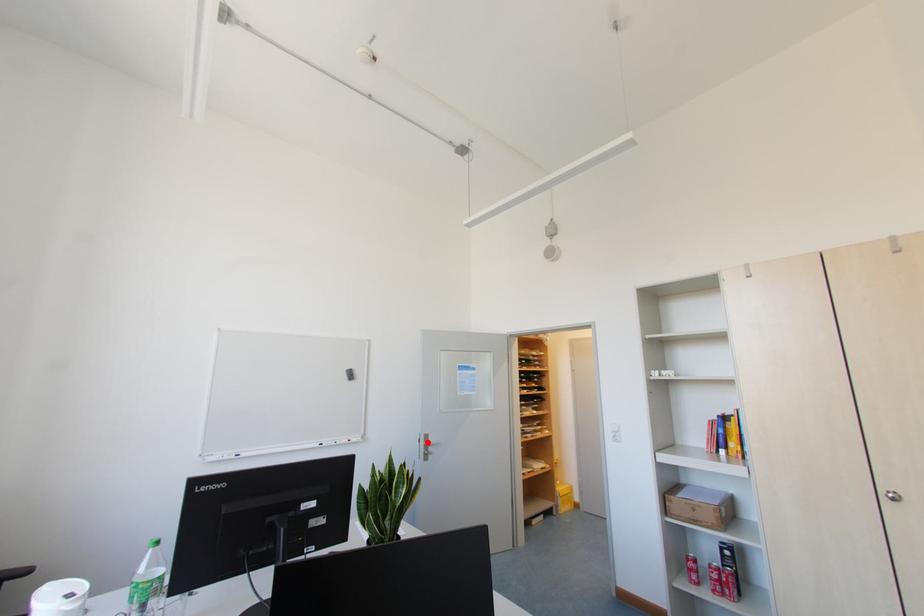
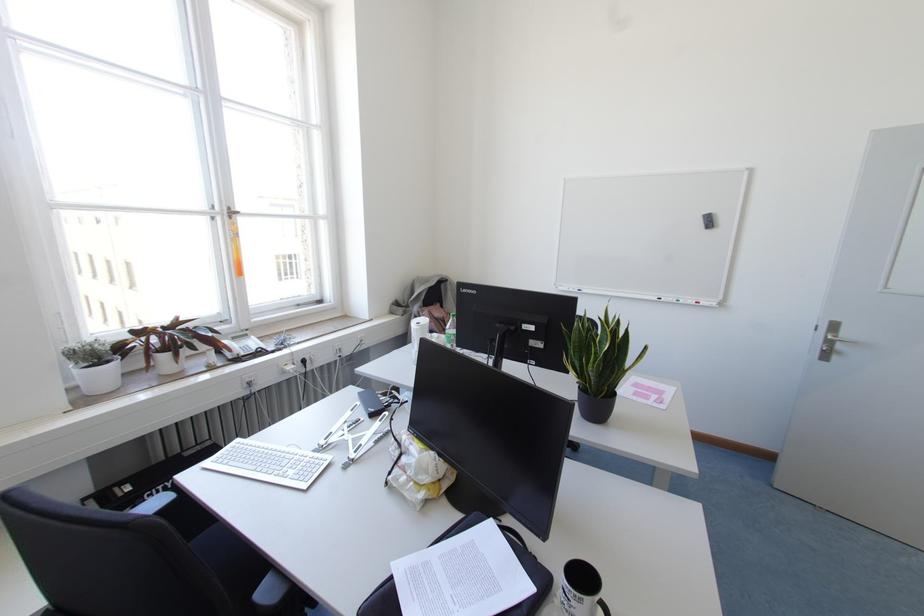
In the second image, find the point that corresponds to the highlighted location in the first image.

(834, 336)